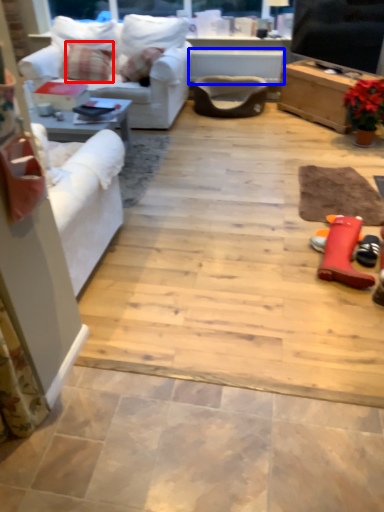
Question: Which object appears closest to the camera in this image, pillow (highlighted by a red box) or table (highlighted by a blue box)?

Choices:
 (A) pillow
 (B) table

Answer: (A)